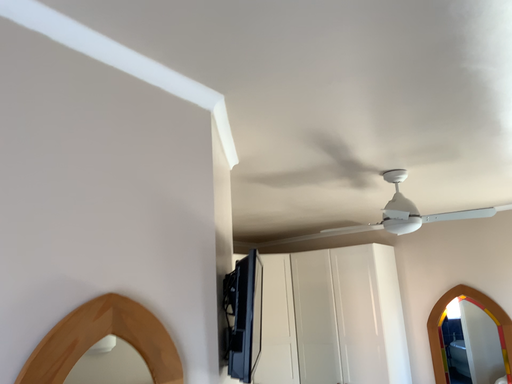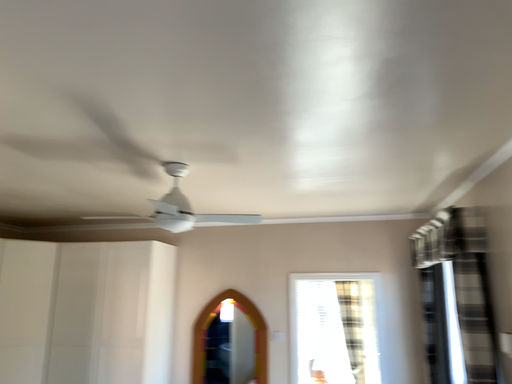
Question: Which way did the camera rotate in the video?

Choices:
 (A) rotated right
 (B) rotated left

Answer: (A)